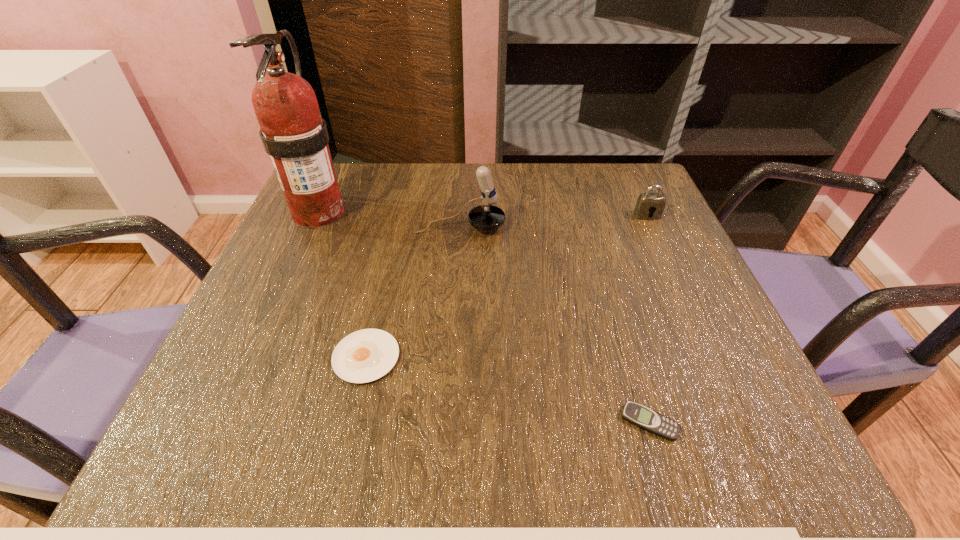
This screenshot has height=540, width=960. Find the location of `vacant space that's between the second tallest object and the second nearest object`. vacant space that's between the second tallest object and the second nearest object is located at coordinates (413, 292).

The width and height of the screenshot is (960, 540). In order to click on unoccupied position between the padlock and the beeper in this screenshot , I will do `click(648, 319)`.

This screenshot has height=540, width=960. I want to click on unoccupied position between the rightmost object and the fourth shortest object, so click(554, 221).

Locate an element on the screen. The height and width of the screenshot is (540, 960). free spot between the fourth farthest object and the third tallest object is located at coordinates coord(507,286).

Identify the location of empty space that is in between the fourth farthest object and the tallest object. (343, 285).

The width and height of the screenshot is (960, 540). What are the coordinates of `empty space that is in between the microphone and the rightmost object` in the screenshot? It's located at (554, 221).

The image size is (960, 540). Find the location of `vacant region between the beeper and the fourth farthest object`. vacant region between the beeper and the fourth farthest object is located at coordinates (508, 389).

The width and height of the screenshot is (960, 540). In order to click on vacant space in between the egg yolk and the third shortest object in this screenshot , I will do `click(507, 286)`.

At what (x,y) coordinates should I click in order to perform the action: click on object that stands as the closest to the padlock. Please return your answer as a coordinate pair (x, y). This screenshot has width=960, height=540. Looking at the image, I should click on (486, 217).

Identify which object is the third nearest to the microphone. Please provide its 2D coordinates. Your answer should be formatted as a tuple, i.e. [(x, y)], where the tuple contains the x and y coordinates of a point satisfying the conditions above.

[(647, 203)]